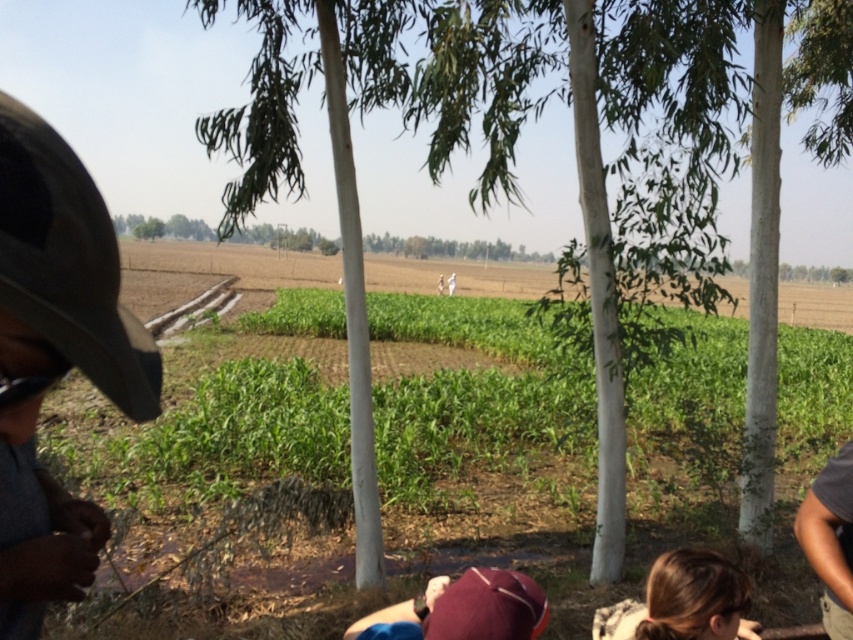
Can you confirm if green leafy tree at center is bigger than maroon fabric cap at lower center?

Correct, green leafy tree at center is larger in size than maroon fabric cap at lower center.

Is point (749, 93) closer to camera compared to point (416, 628)?

No.

Identify the location of green leafy tree at center. This screenshot has width=853, height=640. (577, 170).

How distant is green leafy tree at center from dark gray shirt at lower right?

green leafy tree at center is 3.98 meters away from dark gray shirt at lower right.

Between green leafy tree at center and dark gray shirt at lower right, which one appears on the right side from the viewer's perspective?

green leafy tree at center is more to the right.

What do you see at coordinates (577, 170) in the screenshot? I see `green leafy tree at center` at bounding box center [577, 170].

Locate an element on the screen. This screenshot has width=853, height=640. green leafy tree at center is located at coordinates (577, 170).

Is maroon fabric cap at lower center closer to camera compared to blonde hair at lower right?

Yes.

Is maroon fabric cap at lower center shorter than blonde hair at lower right?

Incorrect, maroon fabric cap at lower center's height does not fall short of blonde hair at lower right's.

What do you see at coordinates (462, 609) in the screenshot? The image size is (853, 640). I see `maroon fabric cap at lower center` at bounding box center [462, 609].

The image size is (853, 640). I want to click on maroon fabric cap at lower center, so click(x=462, y=609).